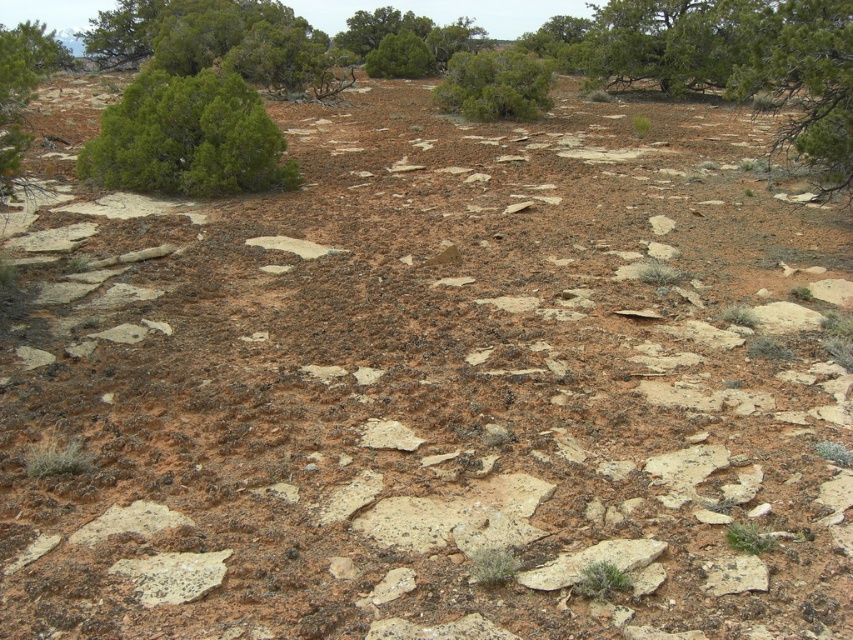
Does green leafy bush at upper left have a smaller size compared to green shrub at center?

Yes, green leafy bush at upper left is smaller than green shrub at center.

Who is taller, green leafy bush at upper left or green shrub at center?

green shrub at center

Is point (141, 164) positioned before point (550, 104)?

Yes, it is in front of point (550, 104).

This screenshot has width=853, height=640. In order to click on green leafy bush at upper left in this screenshot , I will do `click(187, 138)`.

Does green leafy tree at upper right have a larger size compared to green matte bush at upper center?

Yes.

Does green leafy tree at upper right appear under green matte bush at upper center?

Correct, green leafy tree at upper right is located below green matte bush at upper center.

Is point (833, 3) less distant than point (397, 42)?

Yes, point (833, 3) is closer to viewer.

Find the location of a particular element. This screenshot has height=640, width=853. green leafy tree at upper right is located at coordinates (802, 81).

Can you confirm if green shrub at center is thinner than green matte bush at upper center?

No, green shrub at center is not thinner than green matte bush at upper center.

Which is more to the right, green shrub at center or green matte bush at upper center?

green shrub at center is more to the right.

Is point (550, 77) more distant than point (390, 74)?

That is False.

Image resolution: width=853 pixels, height=640 pixels. In order to click on green shrub at center in this screenshot , I will do `click(494, 84)`.